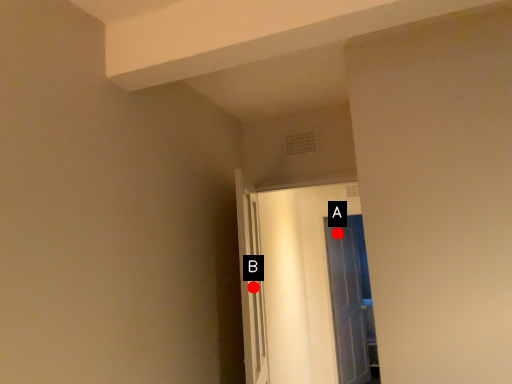
Question: Two points are circled on the image, labeled by A and B beside each circle. Which point is closer to the camera?

Choices:
 (A) A is closer
 (B) B is closer

Answer: (B)